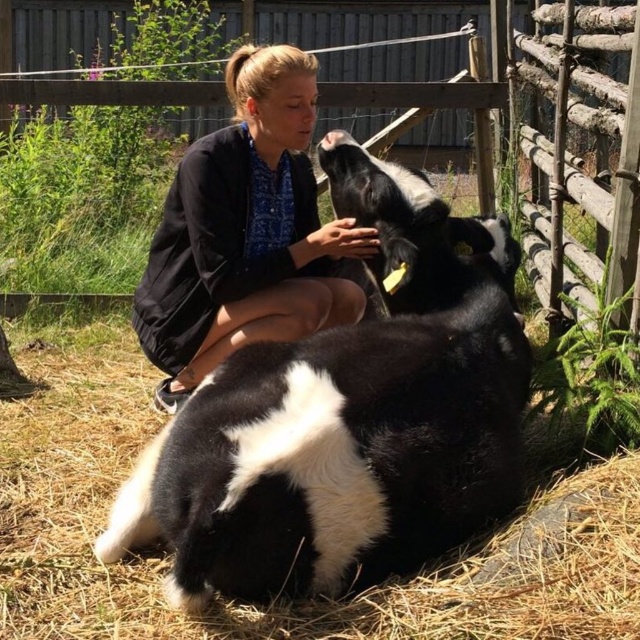
Question: Which point is farther to the camera?

Choices:
 (A) (204, 156)
 (B) (611, 259)

Answer: (A)

Question: Is black and white fur at center wider than wooden fence at upper center?

Choices:
 (A) yes
 (B) no

Answer: (A)

Question: Estimate the real-world distances between objects in this image. Which object is farther from the black and white fur at center?

Choices:
 (A) wooden fence at upper center
 (B) black cotton shorts at center

Answer: (A)

Question: Can you confirm if black and white fur at center is positioned above wooden fence at upper center?

Choices:
 (A) no
 (B) yes

Answer: (A)

Question: Is black cotton shorts at center closer to camera compared to wooden fence at upper center?

Choices:
 (A) yes
 (B) no

Answer: (A)

Question: Which object is positioned farthest from the black cotton shorts at center?

Choices:
 (A) black and white fur at center
 (B) wooden fence at upper center

Answer: (B)